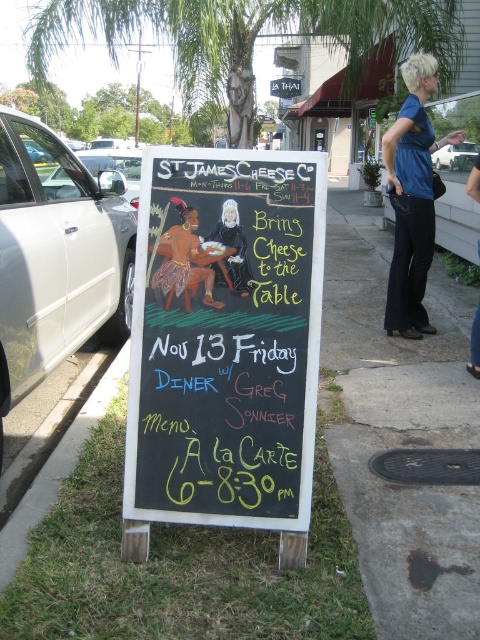
You are a passerby who wants to check the operating hours of St James Cheese Co. displayed on the chalkboard menu at center and the blue cotton shirt at center. Which one is shorter?

The chalkboard menu at center has a lesser height compared to the blue cotton shirt at center, so the chalkboard menu at center is shorter.

You are a customer looking at the black chalkboard at center and the chalkboard menu at center. Which one is positioned higher?

The black chalkboard at center is above the chalkboard menu at center, so it is positioned higher.

You are a customer looking at the chalkboard menu at center and the blue cotton shirt at center. Which object takes up more space on the sign?

The blue cotton shirt at center takes up more space than the chalkboard menu at center.